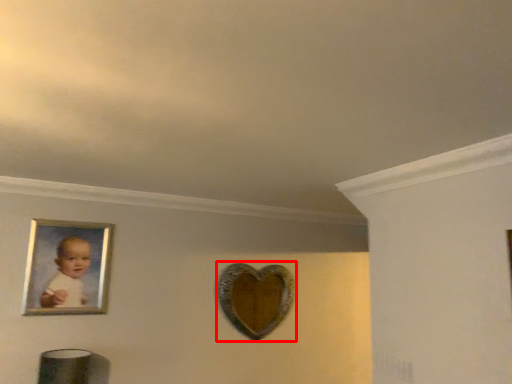
Question: From the image's perspective, considering the relative positions of mirror (annotated by the red box) and picture frame in the image provided, where is mirror (annotated by the red box) located with respect to the staircase?

Choices:
 (A) above
 (B) below

Answer: (B)